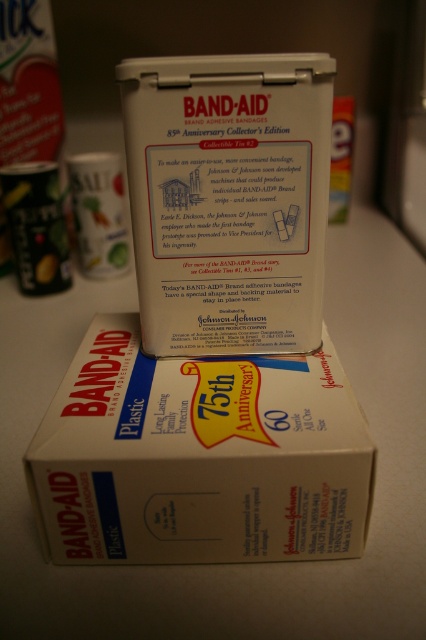
Consider the image. You are a person with a 60 cm long arm. You want to reach the white plastic box at center from where you are standing. Can you reach it with your arm fully extended?

The white plastic box at center is 66.52 centimeters away from the viewer. Since your arm is only 60 cm long, you cannot reach it without moving closer.

You are organizing a first aid kit and need to place both the white plastic box at center and the white matte tin at upper center into a drawer that can only accommodate items up to 12 inches in width. Given their sizes, which item might not fit if the drawer is exactly 12 inches wide?

The white plastic box at center has a larger width than the white matte tin at upper center. If the drawer is exactly 12 inches wide, the white plastic box at center might not fit since it is wider than the tin.